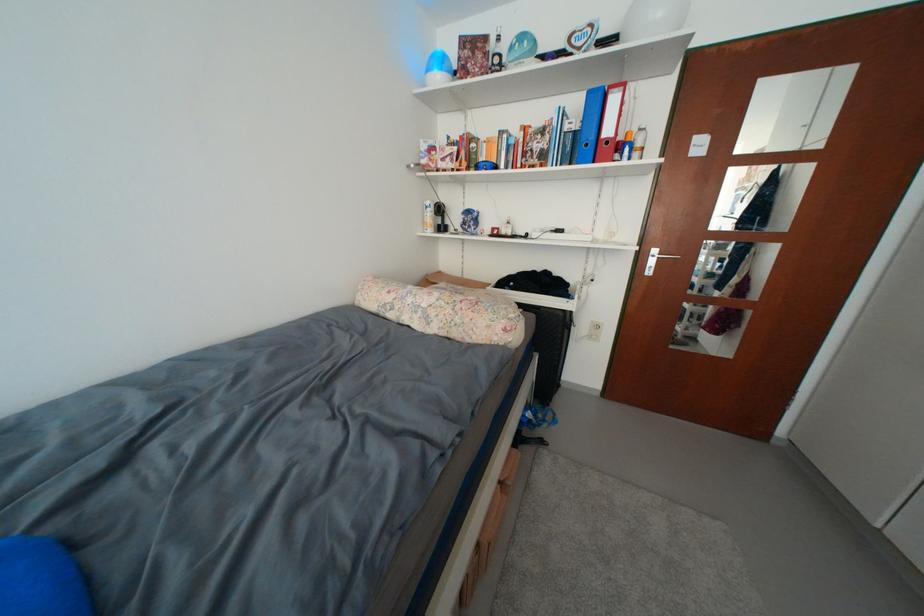
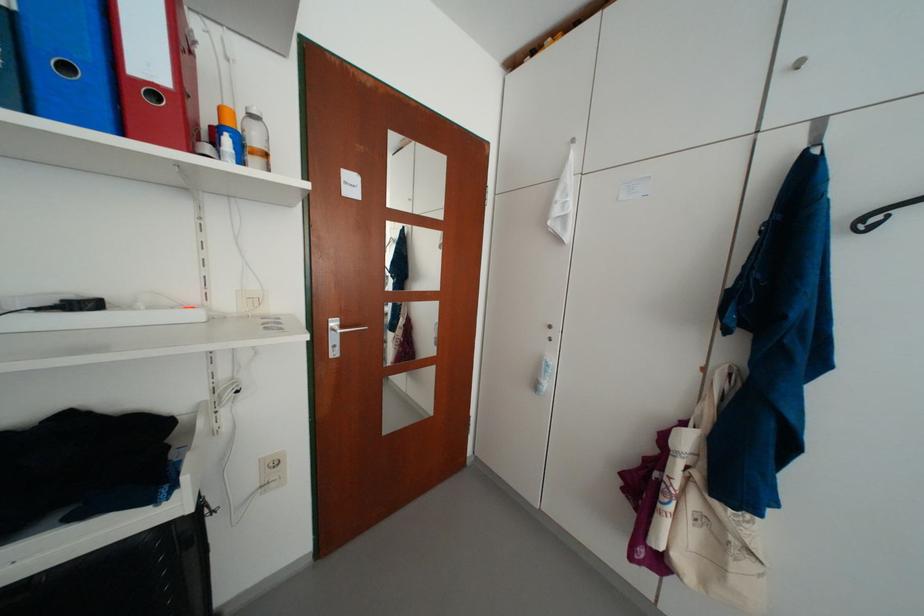
Find the pixel in the second image that matches point (636, 152) in the first image.

(236, 143)